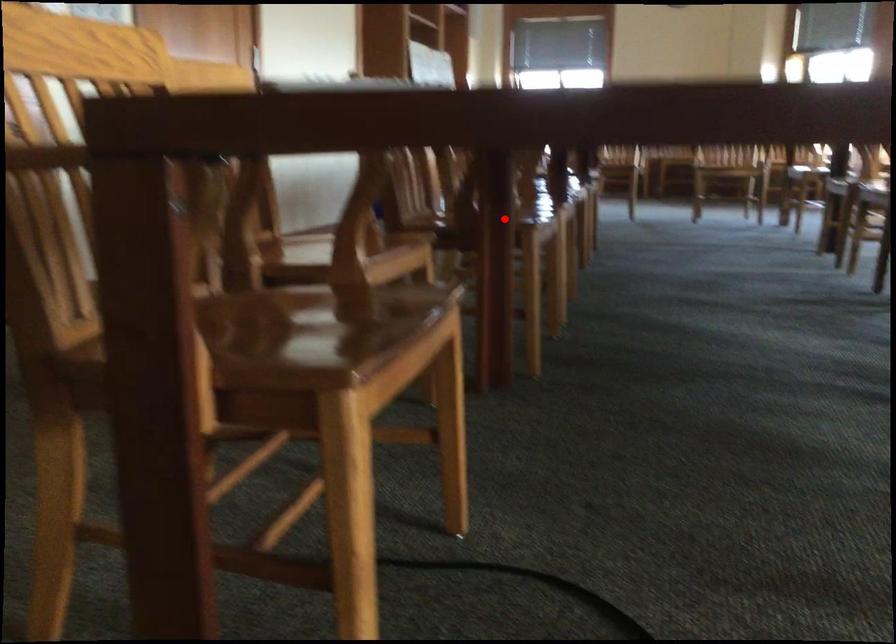
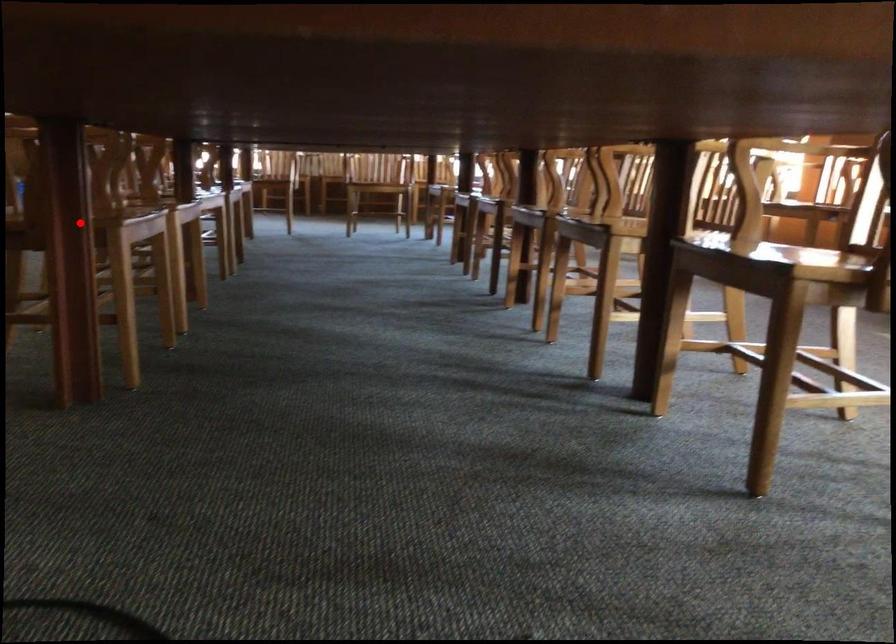
I am providing you with two images of the same scene from different viewpoints. A red point is marked on the first image and another point is marked on the second image. Is the red point in image1 aligned with the point shown in image2?

Yes